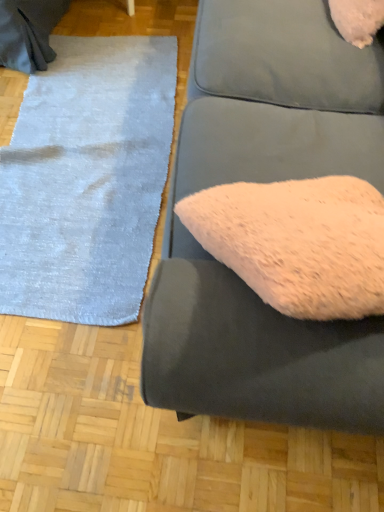
The height and width of the screenshot is (512, 384). Describe the element at coordinates (87, 180) in the screenshot. I see `light blue plush rug at left` at that location.

The height and width of the screenshot is (512, 384). I want to click on light blue plush rug at left, so click(x=87, y=180).

What do you see at coordinates (265, 182) in the screenshot? This screenshot has width=384, height=512. I see `fuzzy fabric couch at center` at bounding box center [265, 182].

Measure the distance between fuzzy fabric couch at center and camera.

fuzzy fabric couch at center and camera are 22.23 inches apart.

You are a GUI agent. You are given a task and a screenshot of the screen. Output one action in this format:
    pyautogui.click(x=<x>, y=<y>)
    Task: Click on the fuzzy fabric couch at center
    Image resolution: width=384 pixels, height=512 pixels.
    Given the screenshot: What is the action you would take?
    pyautogui.click(x=265, y=182)

At what (x,y) coordinates should I click in order to perform the action: click on light blue plush rug at left. Please return your answer as a coordinate pair (x, y). Looking at the image, I should click on (87, 180).

In the image, is light blue plush rug at left on the left side or the right side of fuzzy fabric couch at center?

Based on their positions, light blue plush rug at left is located to the left of fuzzy fabric couch at center.

Is light blue plush rug at left further to camera compared to fuzzy fabric couch at center?

Yes.

Between point (50, 315) and point (376, 46), which one is positioned behind?

The point (50, 315) is more distant.

From the image's perspective, is light blue plush rug at left above or below fuzzy fabric couch at center?

Clearly, from the image's perspective, light blue plush rug at left is above fuzzy fabric couch at center.

From a real-world perspective, which is physically above, light blue plush rug at left or fuzzy fabric couch at center?

fuzzy fabric couch at center, from a real-world perspective.

Looking at their sizes, would you say light blue plush rug at left is wider or thinner than fuzzy fabric couch at center?

light blue plush rug at left is wider than fuzzy fabric couch at center.

From the picture: From their relative heights in the image, would you say light blue plush rug at left is taller or shorter than fuzzy fabric couch at center?

light blue plush rug at left is shorter than fuzzy fabric couch at center.

Considering the relative sizes of light blue plush rug at left and fuzzy fabric couch at center in the image provided, is light blue plush rug at left smaller than fuzzy fabric couch at center?

Indeed, light blue plush rug at left has a smaller size compared to fuzzy fabric couch at center.

Which is correct: light blue plush rug at left is inside fuzzy fabric couch at center, or outside of it?

light blue plush rug at left is outside fuzzy fabric couch at center.

Is light blue plush rug at left far from fuzzy fabric couch at center?

No, light blue plush rug at left is in close proximity to fuzzy fabric couch at center.

Could you tell me if light blue plush rug at left is turned towards fuzzy fabric couch at center?

No.

What's the angular difference between light blue plush rug at left and fuzzy fabric couch at center's facing directions?

The facing directions of light blue plush rug at left and fuzzy fabric couch at center are 91.7 degrees apart.

Measure the distance between light blue plush rug at left and fuzzy fabric couch at center.

light blue plush rug at left is 23.79 inches from fuzzy fabric couch at center.

Identify the location of studio couch in front of the light blue plush rug at left. click(x=265, y=182).

Which object is positioned more to the left, fuzzy fabric couch at center or light blue plush rug at left?

light blue plush rug at left is more to the left.

Which object is closer to the camera taking this photo, fuzzy fabric couch at center or light blue plush rug at left?

Positioned in front is fuzzy fabric couch at center.

Which is behind, point (284, 38) or point (114, 247)?

Point (114, 247)

From the image's perspective, which is above, fuzzy fabric couch at center or light blue plush rug at left?

light blue plush rug at left.

Consider the image. From a real-world perspective, relative to light blue plush rug at left, is fuzzy fabric couch at center vertically above or below?

→ In terms of real-world spatial position, fuzzy fabric couch at center is above light blue plush rug at left.

Can you confirm if fuzzy fabric couch at center is thinner than light blue plush rug at left?

Correct, the width of fuzzy fabric couch at center is less than that of light blue plush rug at left.

From the picture: Does fuzzy fabric couch at center have a greater height compared to light blue plush rug at left?

Indeed, fuzzy fabric couch at center has a greater height compared to light blue plush rug at left.

From the picture: Considering the sizes of objects fuzzy fabric couch at center and light blue plush rug at left in the image provided, who is bigger, fuzzy fabric couch at center or light blue plush rug at left?

fuzzy fabric couch at center is bigger.

Is light blue plush rug at left surrounded by fuzzy fabric couch at center?

No, light blue plush rug at left is not a part of fuzzy fabric couch at center.

Is fuzzy fabric couch at center in contact with light blue plush rug at left?

fuzzy fabric couch at center and light blue plush rug at left are clearly separated.

Is light blue plush rug at left at the back of fuzzy fabric couch at center?

No, fuzzy fabric couch at center is not facing the opposite direction of light blue plush rug at left.

How different are the orientations of fuzzy fabric couch at center and light blue plush rug at left in degrees?

They differ by 91.7 degrees in their facing directions.

I want to click on studio couch above the light blue plush rug at left (from a real-world perspective), so click(265, 182).

The width and height of the screenshot is (384, 512). I want to click on mat behind the fuzzy fabric couch at center, so click(87, 180).

Image resolution: width=384 pixels, height=512 pixels. I want to click on studio couch above the light blue plush rug at left (from a real-world perspective), so click(265, 182).